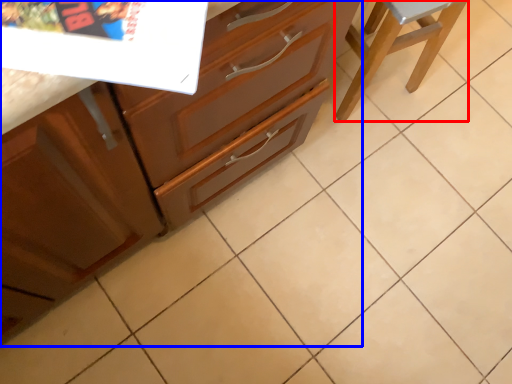
Question: Which object appears farthest to the camera in this image, furniture (highlighted by a red box) or cabinetry (highlighted by a blue box)?

Choices:
 (A) furniture
 (B) cabinetry

Answer: (A)